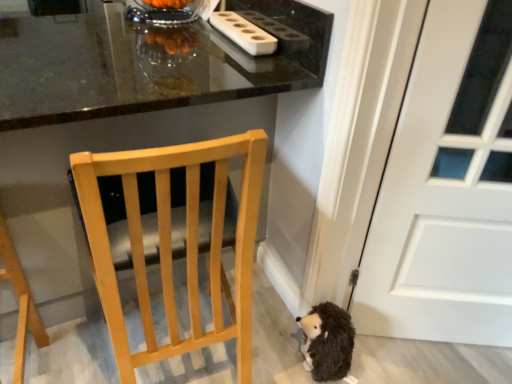
Question: Is light wood chair at center to the right of glossy black table at upper center from the viewer's perspective?

Choices:
 (A) yes
 (B) no

Answer: (A)

Question: Can you confirm if light wood chair at center is taller than glossy black table at upper center?

Choices:
 (A) yes
 (B) no

Answer: (B)

Question: Is light wood chair at center with glossy black table at upper center?

Choices:
 (A) yes
 (B) no

Answer: (B)

Question: From the image's perspective, is light wood chair at center on glossy black table at upper center?

Choices:
 (A) no
 (B) yes

Answer: (A)

Question: Is light wood chair at center positioned beyond the bounds of glossy black table at upper center?

Choices:
 (A) yes
 (B) no

Answer: (B)

Question: Would you say brown fuzzy hedgehog at lower right is inside or outside white matte door at right?

Choices:
 (A) inside
 (B) outside

Answer: (B)

Question: In terms of width, does brown fuzzy hedgehog at lower right look wider or thinner when compared to white matte door at right?

Choices:
 (A) wide
 (B) thin

Answer: (A)

Question: Is brown fuzzy hedgehog at lower right in front of or behind white matte door at right in the image?

Choices:
 (A) behind
 (B) front

Answer: (A)

Question: Based on their sizes in the image, would you say brown fuzzy hedgehog at lower right is bigger or smaller than white matte door at right?

Choices:
 (A) small
 (B) big

Answer: (A)

Question: From the image's perspective, is glossy black table at upper center above or below white matte door at right?

Choices:
 (A) above
 (B) below

Answer: (A)

Question: Looking at the image, does glossy black table at upper center seem bigger or smaller compared to white matte door at right?

Choices:
 (A) big
 (B) small

Answer: (A)

Question: Is glossy black table at upper center taller or shorter than white matte door at right?

Choices:
 (A) tall
 (B) short

Answer: (B)

Question: In terms of width, does glossy black table at upper center look wider or thinner when compared to white matte door at right?

Choices:
 (A) thin
 (B) wide

Answer: (B)

Question: From the image's perspective, is brown fuzzy hedgehog at lower right above or below glossy black table at upper center?

Choices:
 (A) above
 (B) below

Answer: (B)

Question: Looking at the image, does brown fuzzy hedgehog at lower right seem bigger or smaller compared to glossy black table at upper center?

Choices:
 (A) big
 (B) small

Answer: (B)